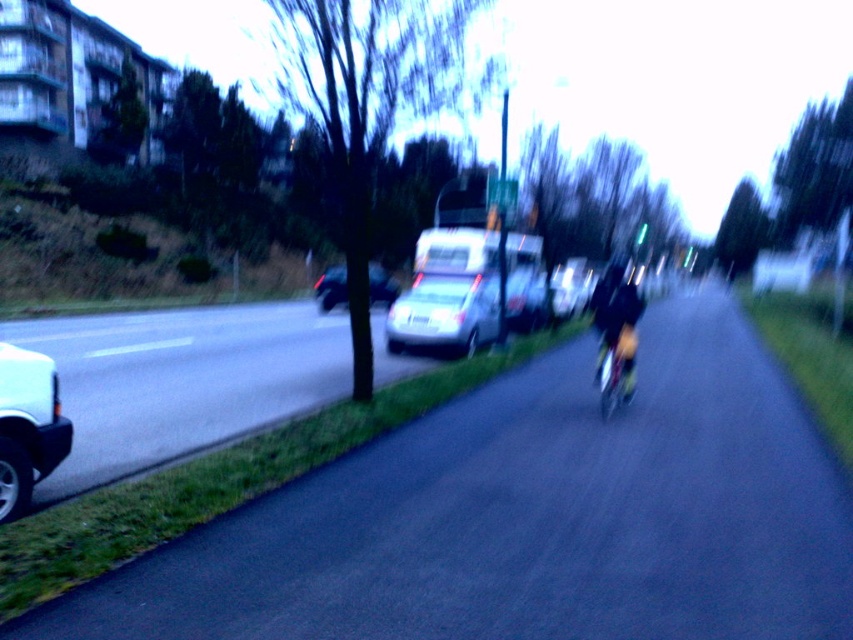
From the picture: You are standing at the camera position and want to place two markers on the ground corresponding to the points point [525,298] and point [386,282]. Which marker should be placed closer to your current position?

Point [525,298] is closer to the camera than point [386,282], so the marker for point [525,298] should be placed closer to your current position.

You are a delivery driver who needs to park your vehicle between the metallic silver van at center and the dark gray matte van at center. Which van should you position your vehicle closer to if you want to maximize the available space for parking?

Result: You should position your vehicle closer to the metallic silver van at center because its width is smaller than the dark gray matte van at center, allowing more space between them.